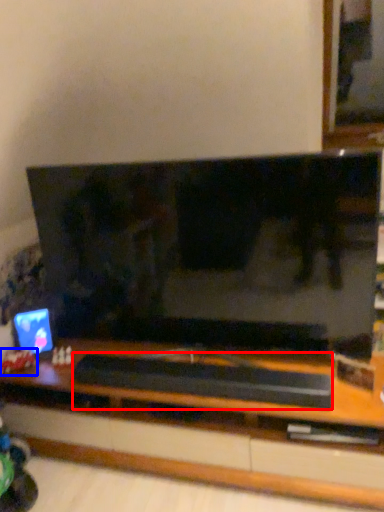
Question: Which object is closer to the camera taking this photo, wide (highlighted by a red box) or toy (highlighted by a blue box)?

Choices:
 (A) wide
 (B) toy

Answer: (A)